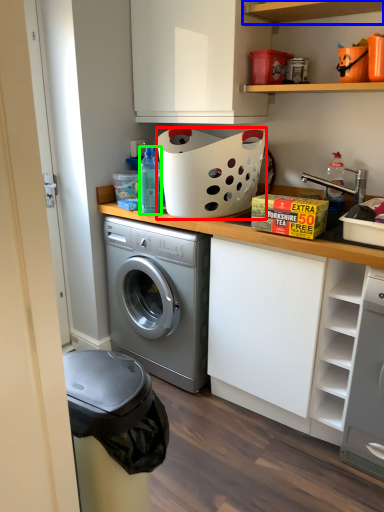
Question: Based on their relative distances, which object is nearer to basket (highlighted by a red box)? Choose from shelf (highlighted by a blue box) and bottle (highlighted by a green box).

Choices:
 (A) shelf
 (B) bottle

Answer: (B)